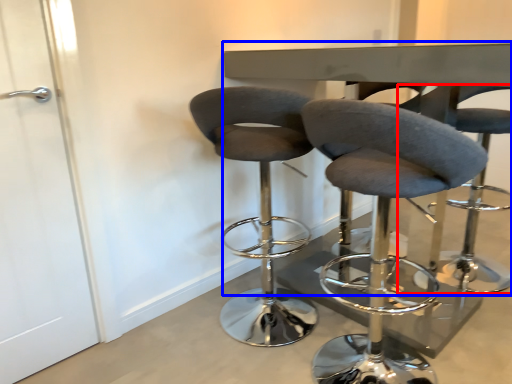
Question: Which point is closer to the camera, chair (highlighted by a red box) or round table (highlighted by a blue box)?

Choices:
 (A) chair
 (B) round table

Answer: (B)